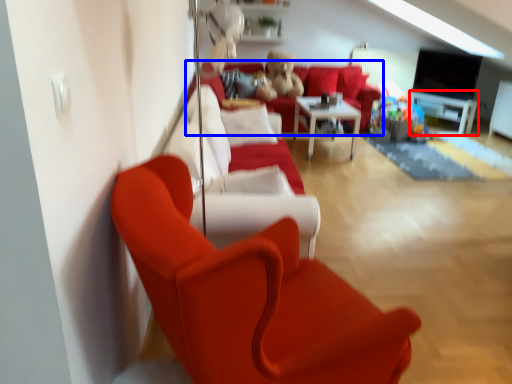
Question: Which object is closer to the camera taking this photo, entertainment center (highlighted by a red box) or studio couch (highlighted by a blue box)?

Choices:
 (A) entertainment center
 (B) studio couch

Answer: (B)